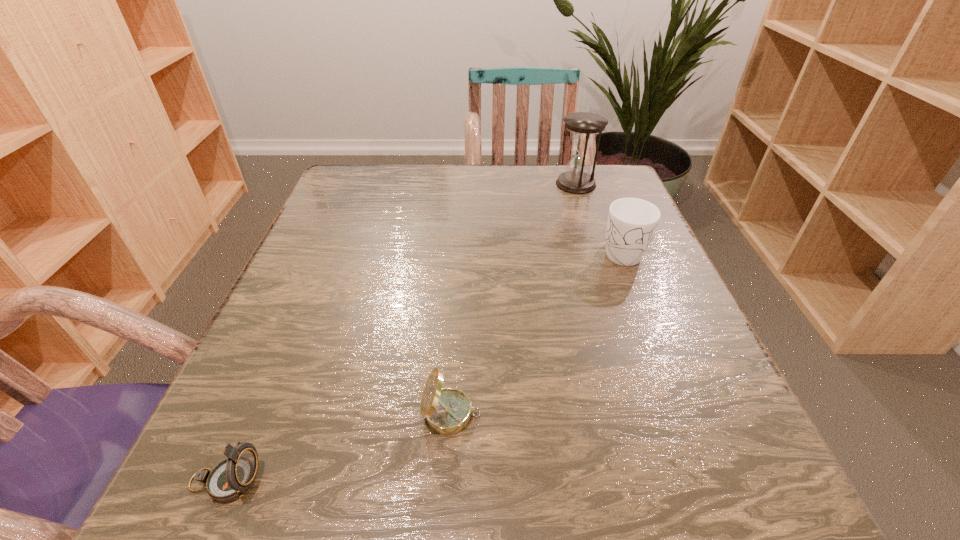
You are a GUI agent. You are given a task and a screenshot of the screen. Output one action in this format:
    pyautogui.click(x=<x>, y=<y>)
    Task: Click on the hourglass
    
    Given the screenshot: What is the action you would take?
    pyautogui.click(x=584, y=126)

What are the coordinates of `the tallest object` in the screenshot? It's located at (584, 126).

This screenshot has height=540, width=960. Find the location of `mug`. mug is located at coordinates (632, 222).

Where is `the third shortest object`? the third shortest object is located at coordinates (632, 222).

Locate an element on the screen. The image size is (960, 540). the right compass is located at coordinates (447, 411).

Where is `the second nearest object`? the second nearest object is located at coordinates (447, 411).

Where is `the nearer compass`? Image resolution: width=960 pixels, height=540 pixels. the nearer compass is located at coordinates (230, 479).

Identify the location of the nearest object. The image size is (960, 540). (230, 479).

The height and width of the screenshot is (540, 960). Find the location of `free space located 0.120m on the left of the tallest object`. free space located 0.120m on the left of the tallest object is located at coordinates (507, 184).

Find the location of a particular element. Image resolution: width=960 pixels, height=540 pixels. blank area located on the side of the mug with the handle is located at coordinates (695, 438).